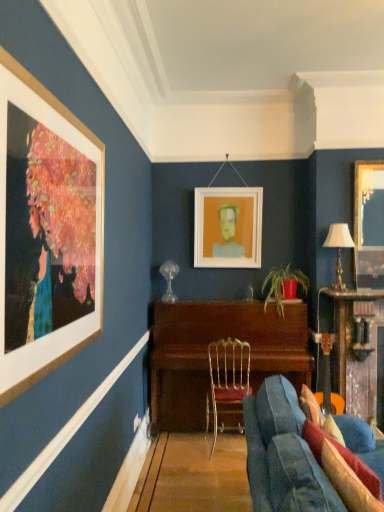
Question: Is wooden table at right, the 1th table viewed from the right, positioned beyond the bounds of wooden piano at center, placed as the first table when sorted from left to right?

Choices:
 (A) no
 (B) yes

Answer: (B)

Question: Considering the relative sizes of wooden table at right, positioned as the second table in left-to-right order, and wooden piano at center, placed as the first table when sorted from left to right, in the image provided, is wooden table at right, positioned as the second table in left-to-right order, taller than wooden piano at center, placed as the first table when sorted from left to right,?

Choices:
 (A) no
 (B) yes

Answer: (B)

Question: Is wooden table at right, positioned as the second table in left-to-right order, facing towards wooden piano at center, placed as the first table when sorted from left to right?

Choices:
 (A) no
 (B) yes

Answer: (A)

Question: Is wooden table at right, positioned as the second table in left-to-right order, in front of wooden piano at center, positioned as the 2th table in right-to-left order?

Choices:
 (A) no
 (B) yes

Answer: (B)

Question: Is wooden table at right, the 1th table viewed from the right, positioned far away from wooden piano at center, placed as the first table when sorted from left to right?

Choices:
 (A) no
 (B) yes

Answer: (A)

Question: Choose the correct answer: Is gold metallic table lamp at right inside white matte picture frame at center, placed as the second picture frame when sorted from right to left, or outside it?

Choices:
 (A) inside
 (B) outside

Answer: (B)

Question: Does point (326, 245) appear closer or farther from the camera than point (248, 249)?

Choices:
 (A) closer
 (B) farther

Answer: (A)

Question: Based on their sizes in the image, would you say gold metallic table lamp at right is bigger or smaller than white matte picture frame at center, which appears as the 1th picture frame when viewed from the left?

Choices:
 (A) big
 (B) small

Answer: (B)

Question: From the image's perspective, is gold metallic table lamp at right above or below white matte picture frame at center, which appears as the 1th picture frame when viewed from the back?

Choices:
 (A) below
 (B) above

Answer: (A)

Question: Is point (359, 317) positioned closer to the camera than point (301, 278)?

Choices:
 (A) closer
 (B) farther

Answer: (A)

Question: From the image's perspective, is wooden table at right, positioned as the second table in left-to-right order, above or below matte red pot at center?

Choices:
 (A) above
 (B) below

Answer: (B)

Question: Is wooden table at right, the 1th table viewed from the right, bigger or smaller than matte red pot at center?

Choices:
 (A) big
 (B) small

Answer: (A)

Question: Looking at their shapes, would you say wooden table at right, the 1th table viewed from the right, is wider or thinner than matte red pot at center?

Choices:
 (A) thin
 (B) wide

Answer: (B)

Question: From a real-world perspective, relative to matte red pot at center, is white matte picture frame at center, which appears as the 1th picture frame when viewed from the back, vertically above or below?

Choices:
 (A) above
 (B) below

Answer: (A)

Question: Would you say white matte picture frame at center, which appears as the 1th picture frame when viewed from the back, is to the left or to the right of matte red pot at center in the picture?

Choices:
 (A) left
 (B) right

Answer: (A)